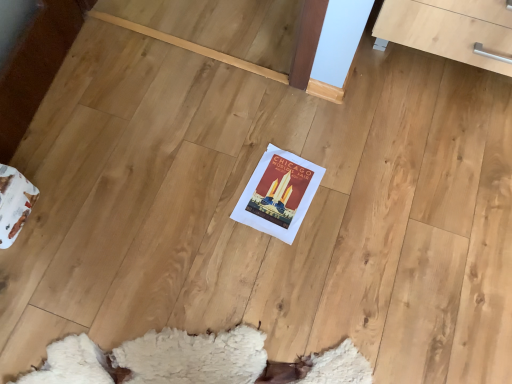
Where is `free point below white paper magazine at center (from a real-world perspective)`? Image resolution: width=512 pixels, height=384 pixels. free point below white paper magazine at center (from a real-world perspective) is located at coordinates (282, 190).